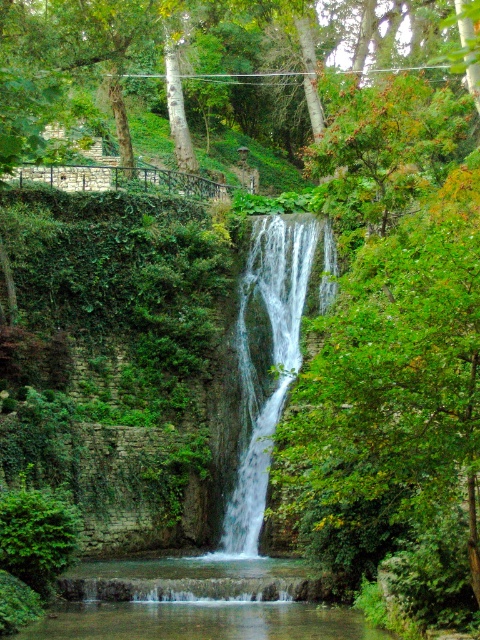
Question: From the image, what is the correct spatial relationship of green leafy tree at upper center in relation to white frothy water at center?

Choices:
 (A) right
 (B) left

Answer: (A)

Question: Which object is positioned closest to the white frothy water at center?

Choices:
 (A) green leafy tree at upper center
 (B) clear water at center

Answer: (B)

Question: Estimate the real-world distances between objects in this image. Which object is farther from the clear water at center?

Choices:
 (A) white frothy water at center
 (B) green leafy tree at upper center

Answer: (B)

Question: From the image, what is the correct spatial relationship of green leafy tree at upper center in relation to white frothy water at center?

Choices:
 (A) right
 (B) left

Answer: (A)

Question: In this image, where is green leafy tree at upper center located relative to clear water at center?

Choices:
 (A) above
 (B) below

Answer: (A)

Question: Which of the following is the farthest from the observer?

Choices:
 (A) white frothy water at center
 (B) clear water at center

Answer: (B)